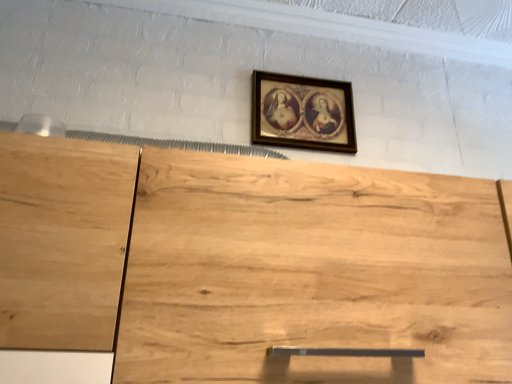
Locate an element on the screen. This screenshot has width=512, height=384. wooden framed portrait at upper center is located at coordinates (302, 112).

What do you see at coordinates (302, 112) in the screenshot?
I see `wooden framed portrait at upper center` at bounding box center [302, 112].

Where is `wooden framed portrait at upper center`? This screenshot has height=384, width=512. wooden framed portrait at upper center is located at coordinates (302, 112).